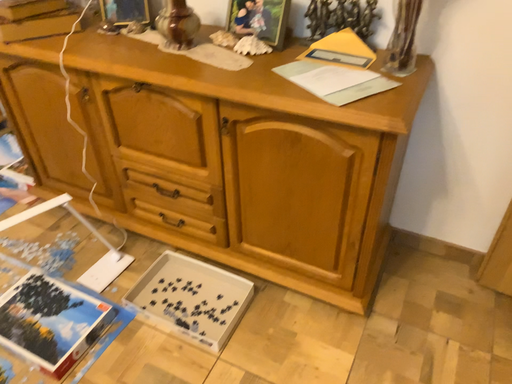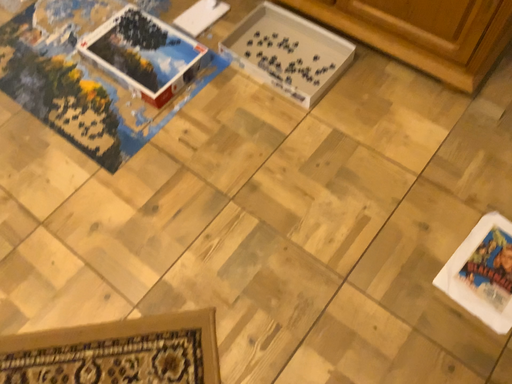
Question: How did the camera likely rotate when shooting the video?

Choices:
 (A) rotated left
 (B) rotated right

Answer: (A)